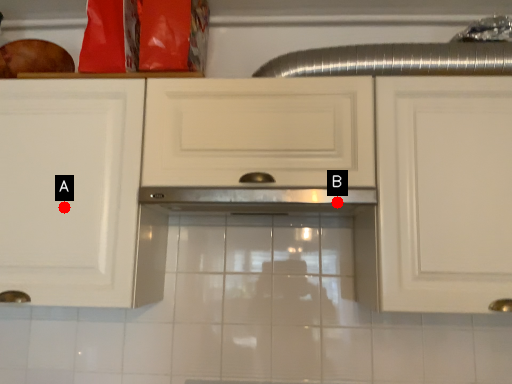
Question: Two points are circled on the image, labeled by A and B beside each circle. Which point is farther to the camera?

Choices:
 (A) A is further
 (B) B is further

Answer: (A)